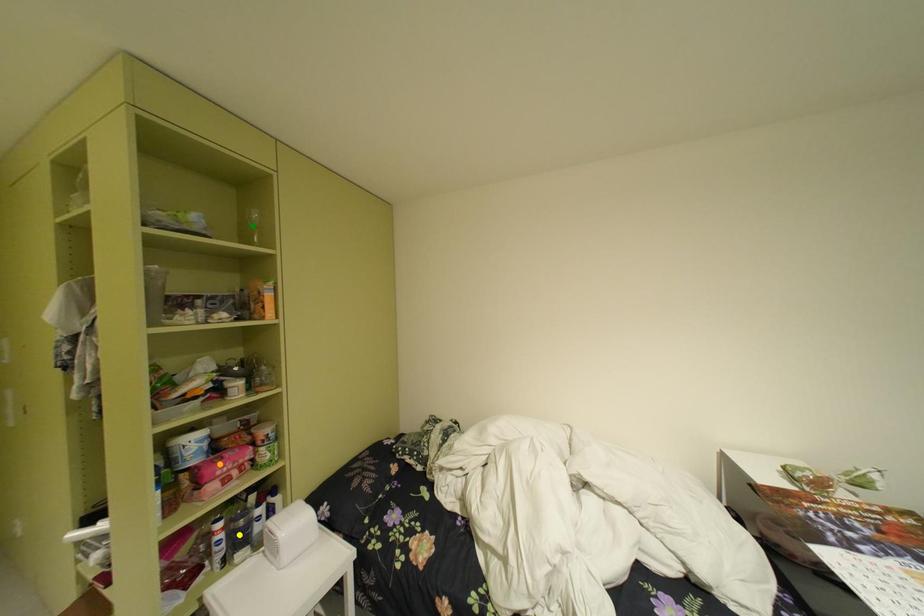
Order these from nearest to farthest:
A) green point
B) yellow point
C) orange point

yellow point < orange point < green point